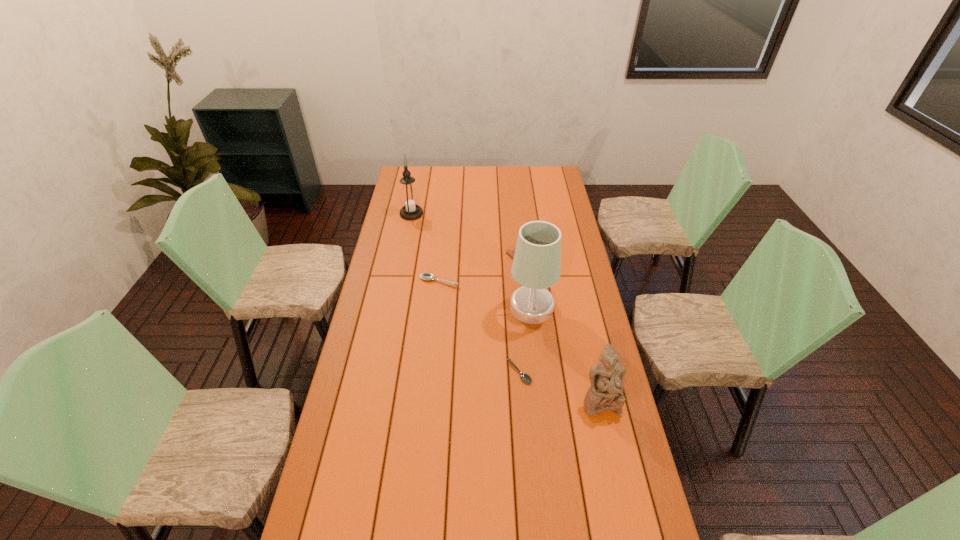
This screenshot has width=960, height=540. Find the location of `figurine that is at the right edge`. figurine that is at the right edge is located at coordinates (606, 378).

The height and width of the screenshot is (540, 960). I want to click on vacant space at the far edge of the desktop, so click(459, 175).

In the image, there is a desktop. Identify the location of vacant area at the near edge. This screenshot has width=960, height=540. (444, 510).

Where is `vacant region at the left edge`? The width and height of the screenshot is (960, 540). vacant region at the left edge is located at coordinates (378, 279).

This screenshot has width=960, height=540. What are the coordinates of `free spot at the right edge of the desktop` in the screenshot? It's located at (549, 197).

Where is `free point at the far left corner`? This screenshot has width=960, height=540. free point at the far left corner is located at coordinates (422, 180).

Locate an element on the screen. Image resolution: width=960 pixels, height=540 pixels. vacant space at the near left corner is located at coordinates (338, 507).

The image size is (960, 540). In order to click on free point at the far right corner in this screenshot , I will do `click(535, 182)`.

You are a GUI agent. You are given a task and a screenshot of the screen. Output one action in this format:
    pyautogui.click(x=<x>, y=<y>)
    Task: Click on the vacant area between the oil lamp and the rightmost object
    The height and width of the screenshot is (540, 960).
    Given the screenshot: What is the action you would take?
    pyautogui.click(x=506, y=307)

The image size is (960, 540). Identify the location of empty location between the farthest object and the left soupspoon. (425, 247).